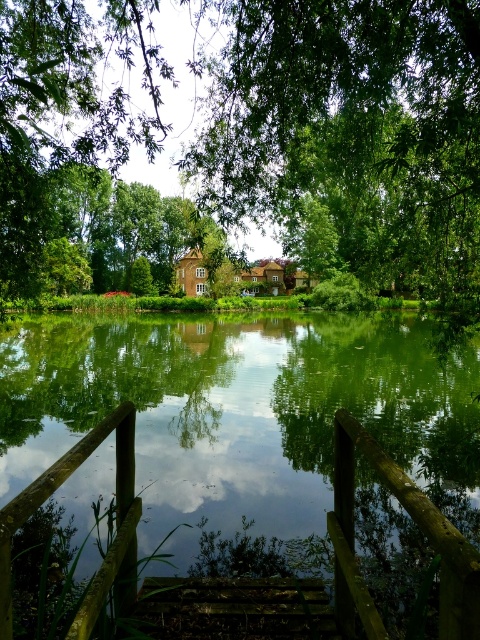
Question: Based on their relative distances, which object is farther from the wooden rail at lower left?

Choices:
 (A) green leafy tree at center
 (B) brown wooden rail at lower center
 (C) brown wooden rail at center

Answer: (A)

Question: Which point is closer to the camera?

Choices:
 (A) brown wooden rail at lower center
 (B) brown wooden rail at center
 (C) wooden rail at lower left
 (D) green leafy tree at center

Answer: (A)

Question: Can you confirm if brown wooden rail at center is wider than brown wooden rail at lower center?

Choices:
 (A) no
 (B) yes

Answer: (B)

Question: Does brown wooden rail at center come in front of wooden rail at lower left?

Choices:
 (A) no
 (B) yes

Answer: (B)

Question: Which is farther from the green leafy tree at center?

Choices:
 (A) brown wooden rail at center
 (B) wooden rail at lower left

Answer: (B)

Question: Does brown wooden rail at lower center appear under wooden rail at lower left?

Choices:
 (A) no
 (B) yes

Answer: (B)